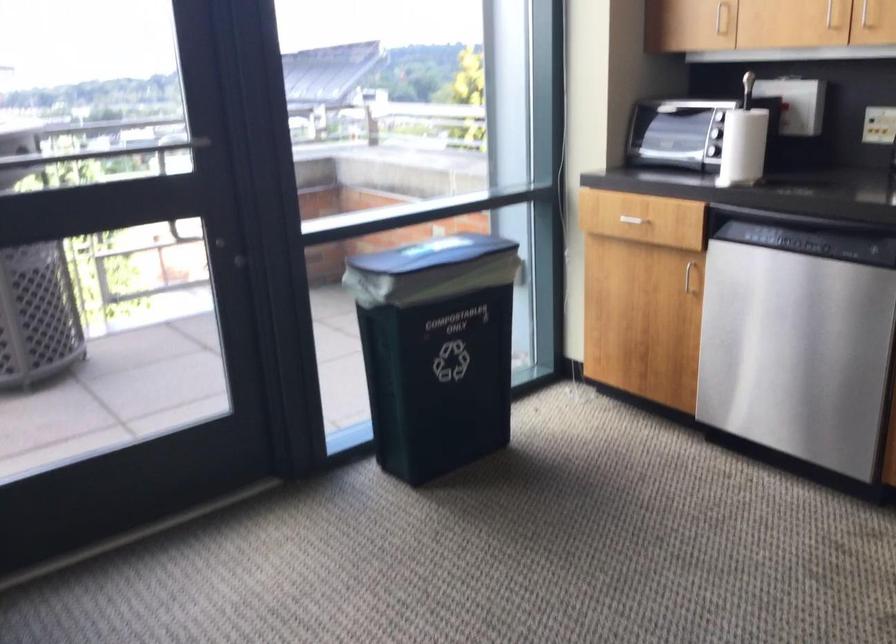
The image size is (896, 644). Identify the location of black door handle. (231, 254).